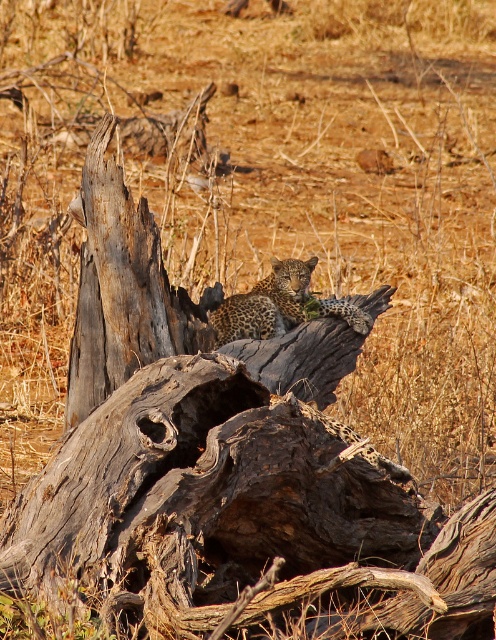
In the scene shown: You are an observer in the savanna and you see the brown rough tree trunk at center and the spotted fur leopard at center. Which object is closer to you?

The brown rough tree trunk at center is closer to you because it is in front of the spotted fur leopard at center.

You are an animal researcher observing the scene. You need to determine which object is taller between the brown rough tree trunk at center and the spotted fur leopard at center. Based on the scene, can you identify which one is taller?

The brown rough tree trunk at center is taller than the spotted fur leopard at center.